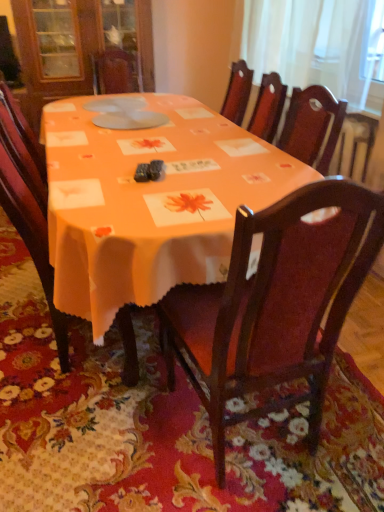
Find the location of a particular element. This screenshot has width=384, height=512. vacant area in front of wooden chair at center, marked as the 1th chair in a left-to-right arrangement is located at coordinates (87, 431).